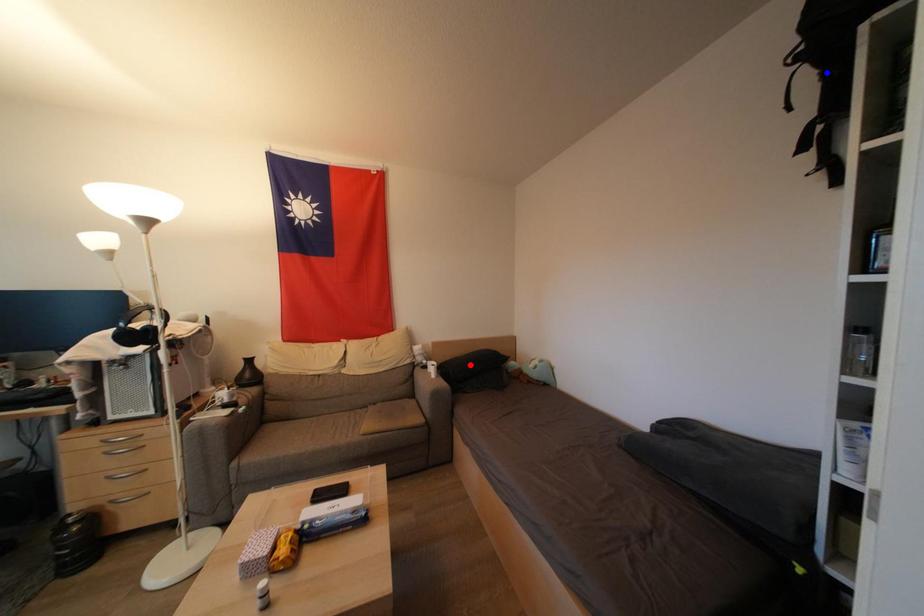
Question: Two points are marked on the image. Which point is closer to the camera?

Choices:
 (A) Blue point is closer.
 (B) Red point is closer.

Answer: (A)